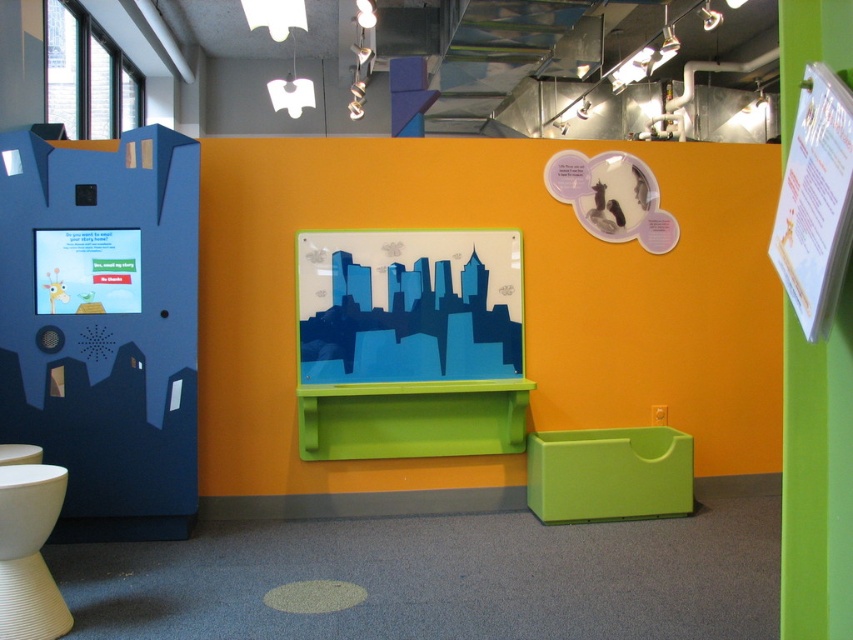
Can you confirm if blue glossy cityscape at center is positioned above white matte toilet bowl at lower left?

Yes.

Consider the image. Does blue glossy cityscape at center appear on the right side of white matte toilet bowl at lower left?

Indeed, blue glossy cityscape at center is positioned on the right side of white matte toilet bowl at lower left.

Who is more distant from viewer, (448, 362) or (42, 483)?

The point (448, 362) is more distant.

Locate an element on the screen. blue glossy cityscape at center is located at coordinates (408, 305).